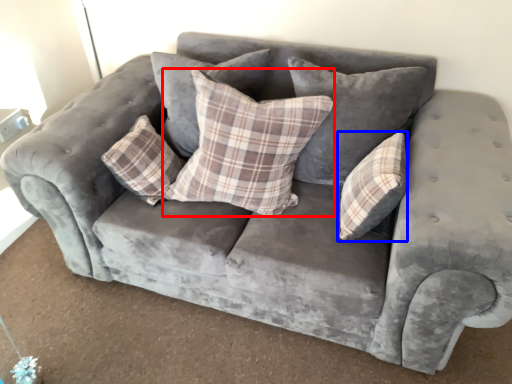
Question: Which of the following is the closest to the observer, pillow (highlighted by a red box) or pillow (highlighted by a blue box)?

Choices:
 (A) pillow
 (B) pillow

Answer: (A)